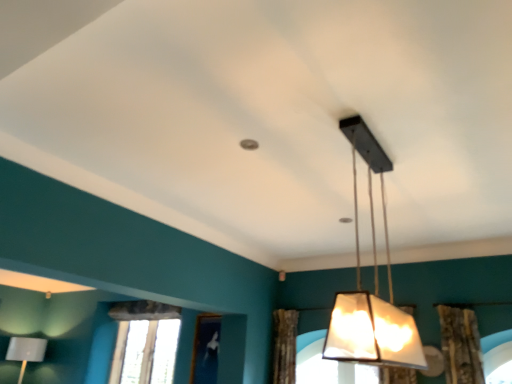
Question: Is the position of matte black lampshade at center, the 1th lamp viewed from the front, more distant than that of clear glass window at lower left?

Choices:
 (A) yes
 (B) no

Answer: (B)

Question: Can you confirm if matte black lampshade at center, the 2th lamp in the back-to-front sequence, is smaller than clear glass window at lower left?

Choices:
 (A) no
 (B) yes

Answer: (A)

Question: Is matte black lampshade at center, the 2th lamp from the left, taller than clear glass window at lower left?

Choices:
 (A) yes
 (B) no

Answer: (A)

Question: Is matte black lampshade at center, the 2th lamp in the back-to-front sequence, next to clear glass window at lower left and touching it?

Choices:
 (A) no
 (B) yes

Answer: (A)

Question: Is matte black lampshade at center, the 2th lamp from the left, positioned before clear glass window at lower left?

Choices:
 (A) no
 (B) yes

Answer: (B)

Question: Does matte black lampshade at center, the 2th lamp from the left, appear on the right side of clear glass window at lower left?

Choices:
 (A) no
 (B) yes

Answer: (B)

Question: Is clear glass window at lower left placed right next to matte gray lampshade at lower left, which ranks as the 1th lamp in left-to-right order?

Choices:
 (A) no
 (B) yes

Answer: (A)

Question: Is clear glass window at lower left thinner than matte gray lampshade at lower left, positioned as the 2th lamp in front-to-back order?

Choices:
 (A) no
 (B) yes

Answer: (B)

Question: Does clear glass window at lower left turn towards matte gray lampshade at lower left, placed as the second lamp when sorted from top to bottom?

Choices:
 (A) no
 (B) yes

Answer: (A)

Question: From a real-world perspective, is clear glass window at lower left positioned over matte gray lampshade at lower left, positioned as the 2th lamp in front-to-back order, based on gravity?

Choices:
 (A) no
 (B) yes

Answer: (B)

Question: Is clear glass window at lower left behind matte gray lampshade at lower left, which is the 1th lamp from back to front?

Choices:
 (A) yes
 (B) no

Answer: (B)

Question: Is clear glass window at lower left turned away from matte gray lampshade at lower left, positioned as the 2th lamp in front-to-back order?

Choices:
 (A) no
 (B) yes

Answer: (A)

Question: Does brown textured curtain at center appear on the right side of matte black lampshade at center, the second lamp positioned from the bottom?

Choices:
 (A) no
 (B) yes

Answer: (A)